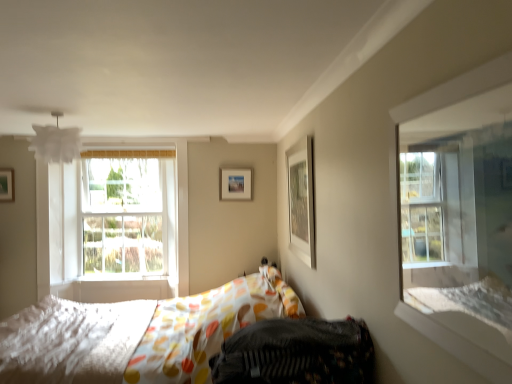
Question: In terms of width, does matte white picture frame at upper right, placed as the first picture frame when sorted from front to back, look wider or thinner when compared to matte wooden picture frame at center, the 2th picture frame viewed from the left?

Choices:
 (A) wide
 (B) thin

Answer: (A)

Question: From the image's perspective, is matte white picture frame at upper right, the 1th picture frame positioned from the right, positioned above or below matte wooden picture frame at center, arranged as the second picture frame when viewed from the right?

Choices:
 (A) above
 (B) below

Answer: (B)

Question: Which is farther from the matte white picture frame at upper right, which ranks as the 3th picture frame in back-to-front order?

Choices:
 (A) white textured mattress at lower left
 (B) clear glass window at upper right
 (C) patterned fabric bed at center
 (D) matte wooden picture frame at center, which appears as the 1th picture frame when viewed from the back
 (E) matte white picture frame at upper left, placed as the 1th picture frame when sorted from left to right

Answer: (E)

Question: Based on their relative distances, which object is farther from the matte white picture frame at upper left, placed as the 1th picture frame when sorted from left to right?

Choices:
 (A) clear glass window at upper right
 (B) matte wooden picture frame at center, placed as the third picture frame when sorted from front to back
 (C) white textured mattress at lower left
 (D) patterned fabric bed at center
 (E) matte white picture frame at upper right, which ranks as the 3th picture frame in back-to-front order

Answer: (A)